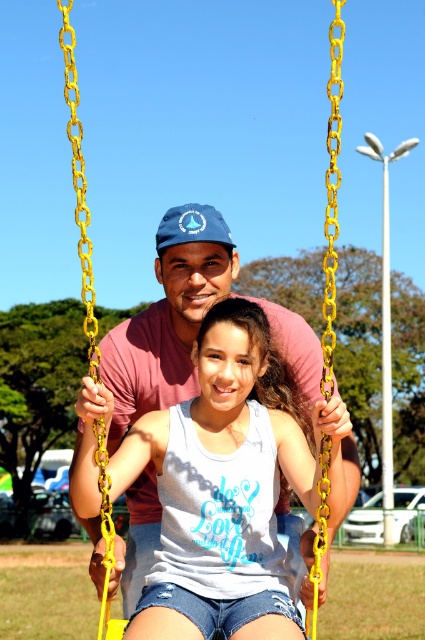
You are a photographer trying to capture the man in the blue fabric baseball cap at center without including the white cotton tank top at center in the frame. Is this possible given their current positions?

The white cotton tank top at center is positioned under the blue fabric baseball cap at center, so it might be challenging to capture the blue fabric baseball cap at center without including the white cotton tank top at center in the frame.

You are a photographer trying to capture both the white cotton tank top at center and the blue fabric baseball cap at center in a single frame. Which object should you focus on first to ensure both are in the frame?

You should focus on the blue fabric baseball cap at center first because it is larger than the white cotton tank top at center, allowing you to frame it first and then adjust to include the smaller tank top.